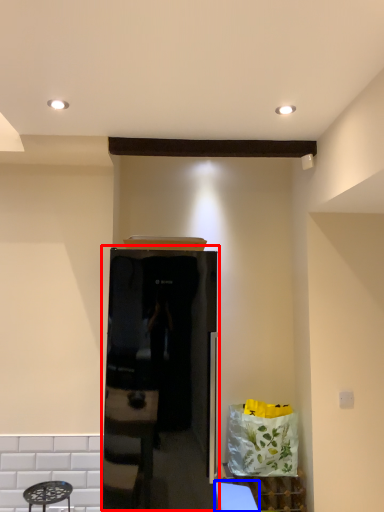
Question: Which point is further to the camera, appliance (highlighted by a red box) or table (highlighted by a blue box)?

Choices:
 (A) appliance
 (B) table

Answer: (B)